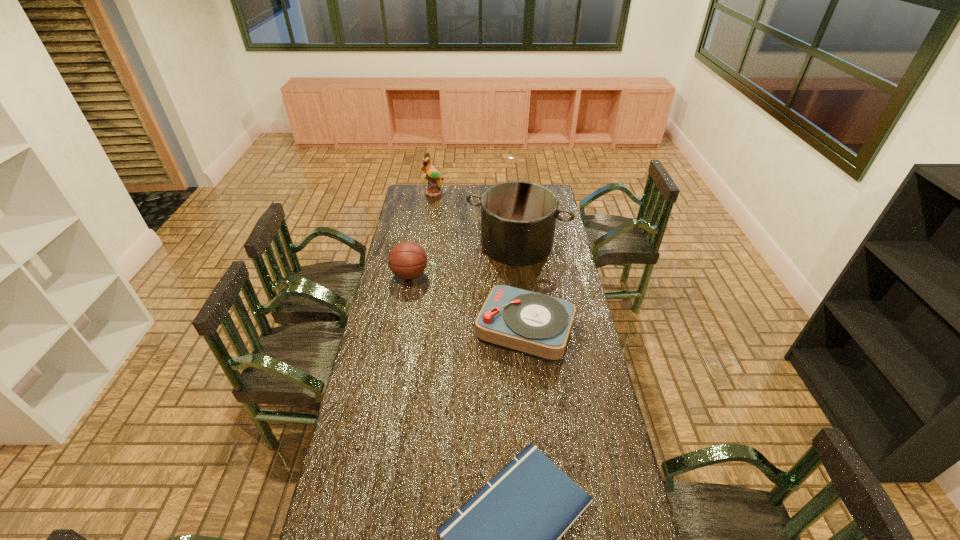
The height and width of the screenshot is (540, 960). I want to click on parrot at the left edge, so click(433, 176).

The image size is (960, 540). Find the location of `basketball that is positioned at the left edge`. basketball that is positioned at the left edge is located at coordinates (407, 260).

Where is `pan that is at the right edge`? pan that is at the right edge is located at coordinates click(518, 218).

At what (x,y) coordinates should I click in order to perform the action: click on record player positioned at the right edge. Please return your answer as a coordinate pair (x, y). Image resolution: width=960 pixels, height=540 pixels. Looking at the image, I should click on 539,325.

The width and height of the screenshot is (960, 540). I want to click on object positioned at the far left corner, so click(x=433, y=176).

This screenshot has width=960, height=540. I want to click on free space at the far edge of the desktop, so click(436, 200).

Locate an element on the screen. The height and width of the screenshot is (540, 960). vacant space at the left edge is located at coordinates (406, 315).

The image size is (960, 540). Identify the location of blank space at the right edge. (554, 254).

This screenshot has width=960, height=540. In the image, there is a desktop. Find the location of `blank space at the far left corner`. blank space at the far left corner is located at coordinates (426, 195).

Find the location of a particular element. This screenshot has height=540, width=960. free space between the farthest object and the fourth farthest object is located at coordinates (479, 261).